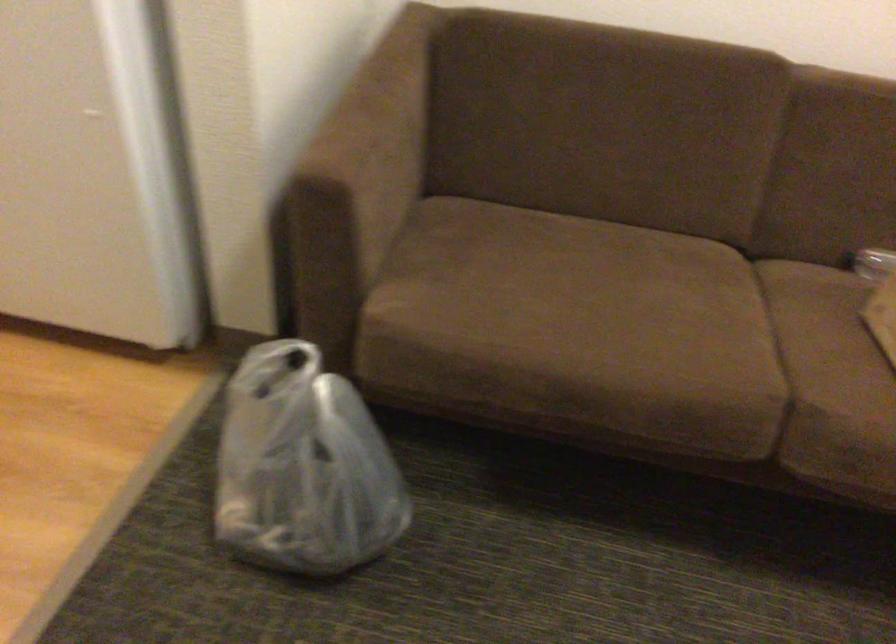
Describe the element at coordinates (882, 315) in the screenshot. The image size is (896, 644). I see `the sofa sitting surface` at that location.